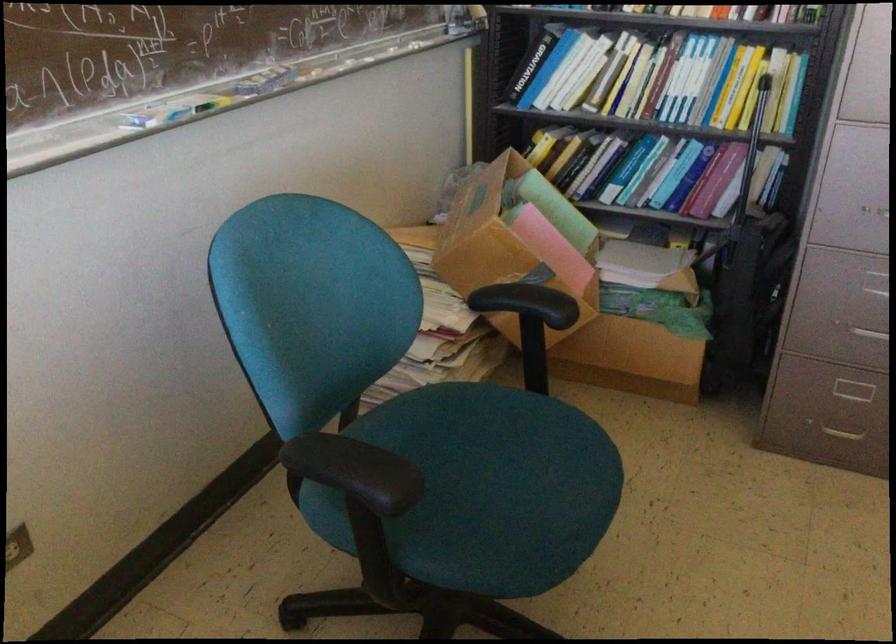
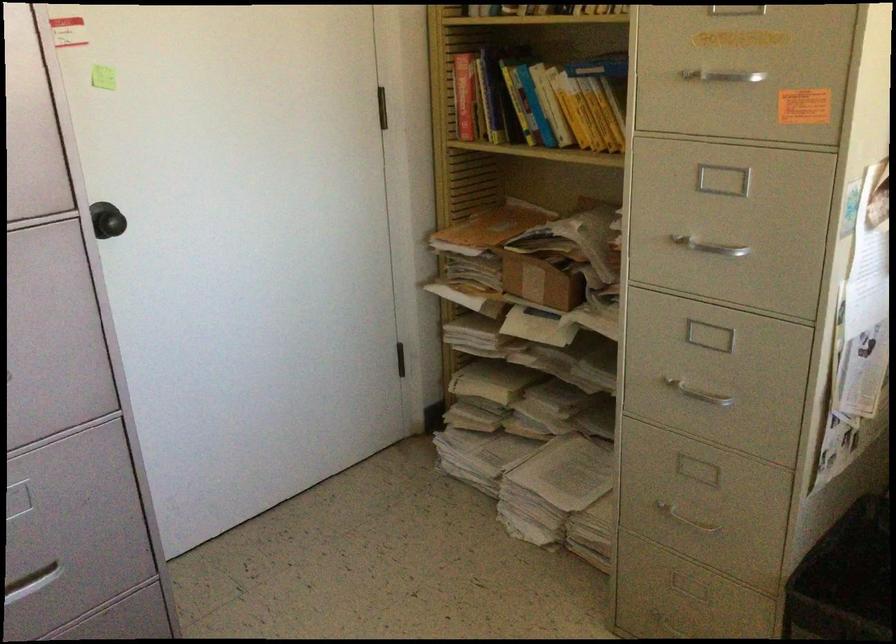
Question: The first image is from the beginning of the video and the second image is from the end. How did the camera likely rotate when shooting the video?

Choices:
 (A) Left
 (B) Right
 (C) Up
 (D) Down

Answer: (B)